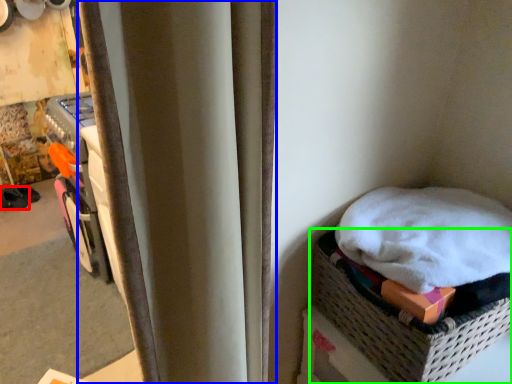
Question: Estimate the real-world distances between objects in this image. Which object is closer to footwear (highlighted by a red box), curtain (highlighted by a blue box) or basket (highlighted by a green box)?

Choices:
 (A) curtain
 (B) basket

Answer: (B)